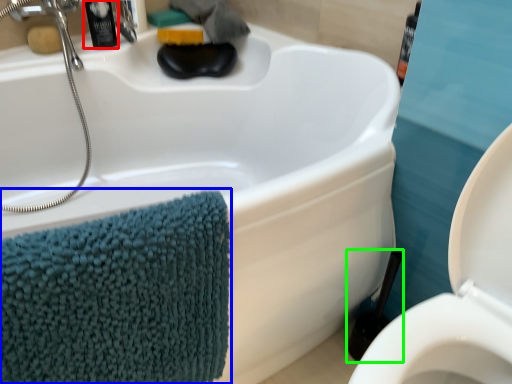
Question: Which object is the closest to the toiletry (highlighted by a red box)? Choose among these: bath towel (highlighted by a blue box) or brush (highlighted by a green box).

Choices:
 (A) bath towel
 (B) brush

Answer: (A)